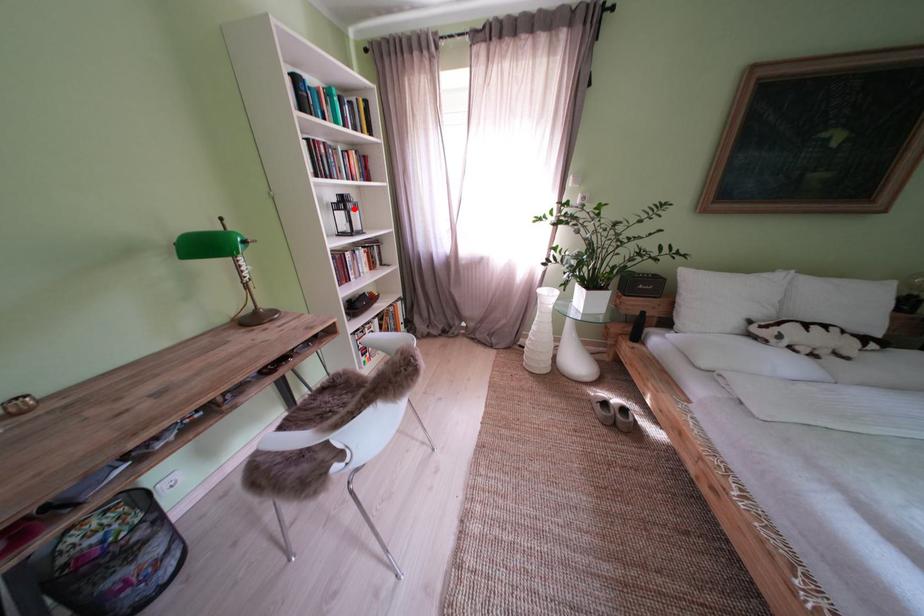
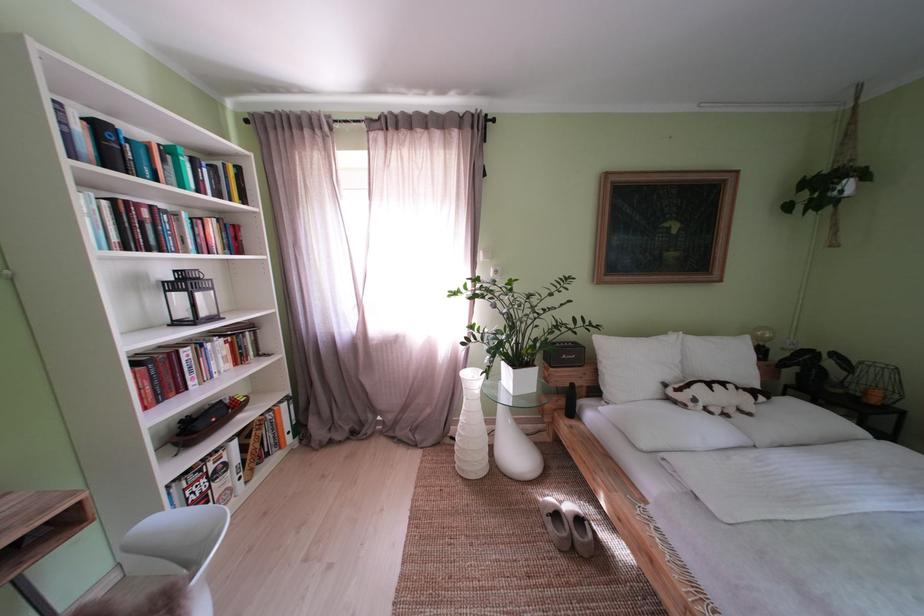
Locate, in the second image, the point that corresponds to the highlighted location in the first image.

(198, 286)